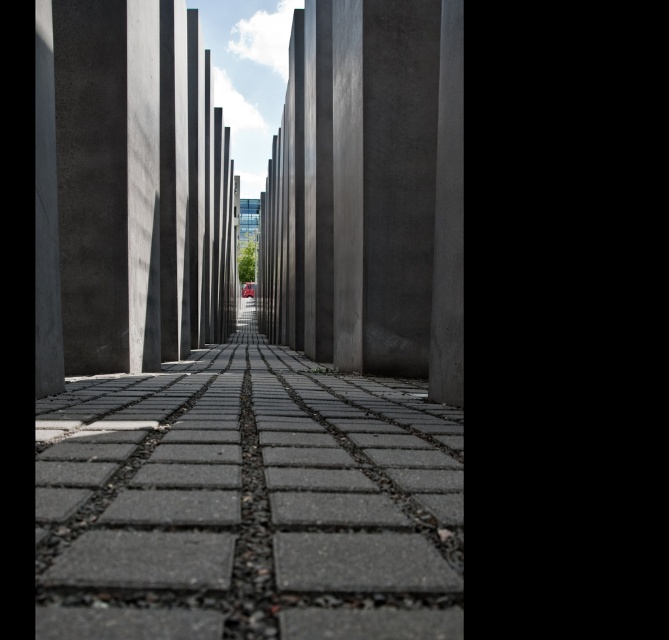
Who is positioned more to the left, gray concrete pavement at center or smooth concrete pillar at center?

Positioned to the left is smooth concrete pillar at center.

Who is taller, gray concrete pavement at center or smooth concrete pillar at center?

smooth concrete pillar at center is taller.

Is point (355, 579) positioned before point (221, 211)?

That is True.

This screenshot has height=640, width=669. What are the coordinates of `gray concrete pavement at center` in the screenshot? It's located at (248, 502).

Which is below, sleek concrete pillar at center or smooth concrete pillar at center?

Positioned lower is sleek concrete pillar at center.

Who is more distant from viewer, (427, 108) or (41, 3)?

The point (427, 108) is behind.

Identify the location of sleek concrete pillar at center. This screenshot has width=669, height=640. (371, 193).

Does gray concrete pavement at center have a smaller size compared to sleek concrete pillar at center?

Yes, gray concrete pavement at center is smaller than sleek concrete pillar at center.

Is gray concrete pavement at center to the right of sleek concrete pillar at center from the viewer's perspective?

Incorrect, gray concrete pavement at center is not on the right side of sleek concrete pillar at center.

Is point (432, 492) closer to camera compared to point (421, 365)?

Yes, it is in front of point (421, 365).

Image resolution: width=669 pixels, height=640 pixels. What are the coordinates of `gray concrete pavement at center` in the screenshot? It's located at (248, 502).